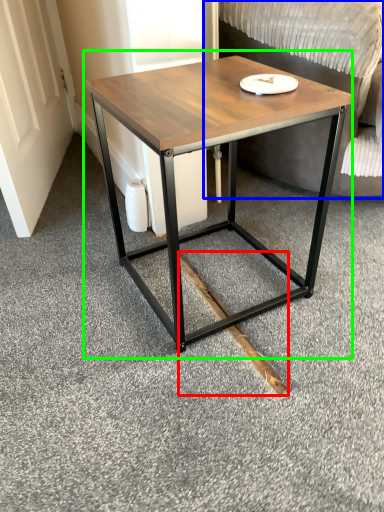
Question: Which object is positioned farthest from wood (highlighted by a red box)? Select from swivel chair (highlighted by a blue box) and coffee table (highlighted by a green box).

Choices:
 (A) swivel chair
 (B) coffee table

Answer: (A)